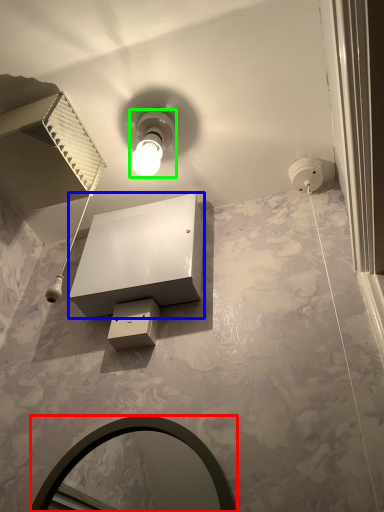
Question: Estimate the real-world distances between objects in this image. Which object is closer to mirror (highlighted by a red box), vanity (highlighted by a blue box) or light fixture (highlighted by a green box)?

Choices:
 (A) vanity
 (B) light fixture

Answer: (A)